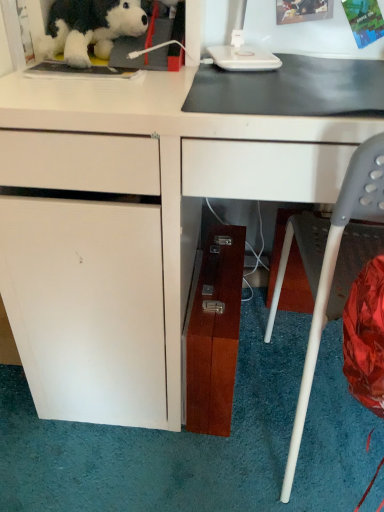
Question: Is white matte desk at center in front of or behind fluffy plush dog at upper left in the image?

Choices:
 (A) front
 (B) behind

Answer: (A)

Question: Would you say white matte desk at center is inside or outside fluffy plush dog at upper left?

Choices:
 (A) inside
 (B) outside

Answer: (B)

Question: Estimate the real-world distances between objects in this image. Which object is farther from the wooden file cabinet at lower center?

Choices:
 (A) white matte desk at center
 (B) fluffy plush dog at upper left
 (C) gray plastic chair at lower right

Answer: (B)

Question: Which object is positioned closest to the wooden file cabinet at lower center?

Choices:
 (A) fluffy plush dog at upper left
 (B) white matte desk at center
 (C) gray plastic chair at lower right

Answer: (C)